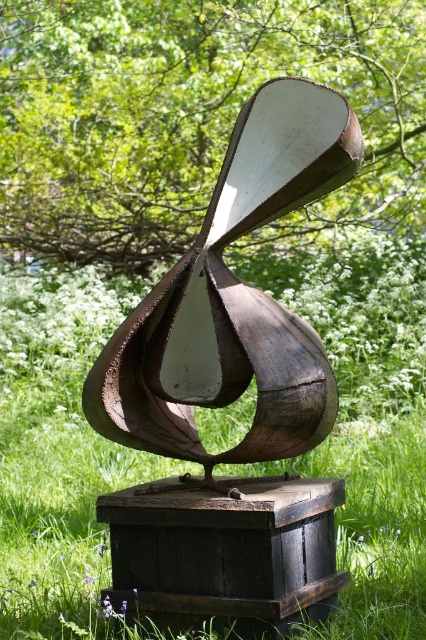
Can you confirm if rusty metal abstract at center is positioned above dark brown wooden box at center?

Correct, rusty metal abstract at center is located above dark brown wooden box at center.

Is point (284, 332) more distant than point (252, 595)?

That is True.

Image resolution: width=426 pixels, height=640 pixels. In order to click on rusty metal abstract at center in this screenshot , I will do `click(233, 300)`.

Which is behind, point (411, 160) or point (368, 618)?

The point (411, 160) is more distant.

Which is behind, point (149, 118) or point (83, 557)?

The point (149, 118) is more distant.

Where is `green matte tree at upper center`? The image size is (426, 640). green matte tree at upper center is located at coordinates (187, 115).

Looking at this image, between green matte tree at upper center and rusty metal abstract at center, which one has less height?

Standing shorter between the two is rusty metal abstract at center.

Can you confirm if green matte tree at upper center is thinner than rusty metal abstract at center?

No, green matte tree at upper center is not thinner than rusty metal abstract at center.

Is point (51, 65) positioned before point (86, 412)?

No, (51, 65) is behind (86, 412).

Where is `green matte tree at upper center`? This screenshot has width=426, height=640. green matte tree at upper center is located at coordinates (187, 115).